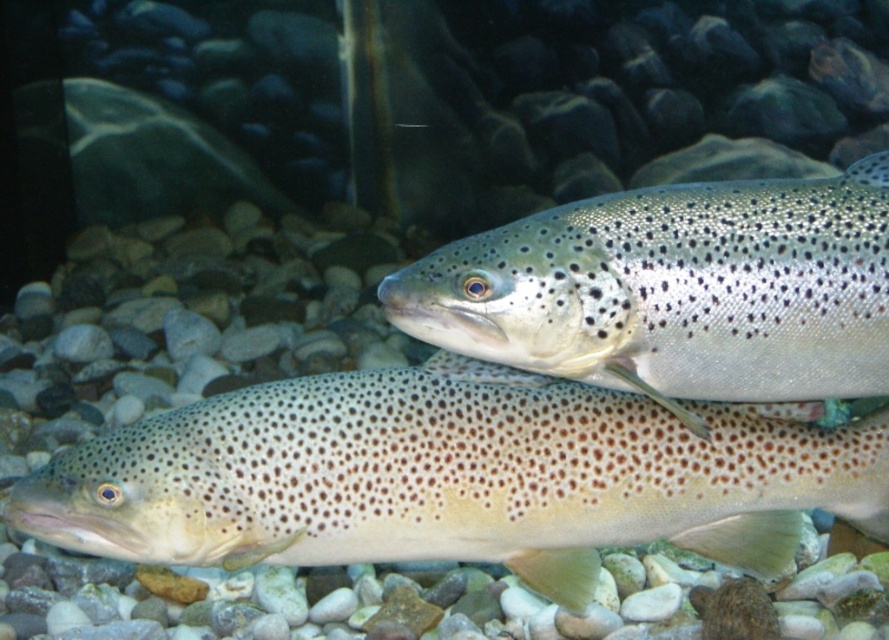
Who is more distant from viewer, [428,449] or [397,310]?

Point [428,449]

Consider the image. Which is above, speckled skin fish at center or speckled silver fish at center?

speckled silver fish at center

At what (x,y) coordinates should I click in order to perform the action: click on speckled skin fish at center. Please return your answer as a coordinate pair (x, y). Looking at the image, I should click on (454, 477).